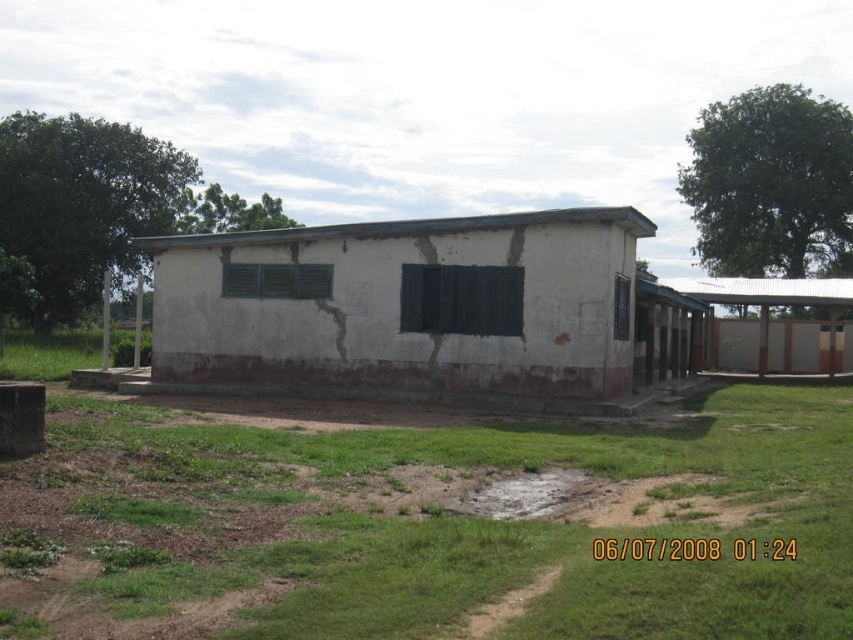
You are standing at the edge of the scene and want to reach the white matte building at center. Which direction should you move relative to the green grass at lower center?

Since the green grass at lower center is located below the white matte building at center, you should move upward from the green grass at lower center to reach the white matte building at center.

You are standing in front of the building and want to walk towards the two points marked in the image. Which point, point (160, 264) or point (737, 300), will you reach first?

You will reach point (160, 264) first because it is closer to the viewer than point (737, 300).